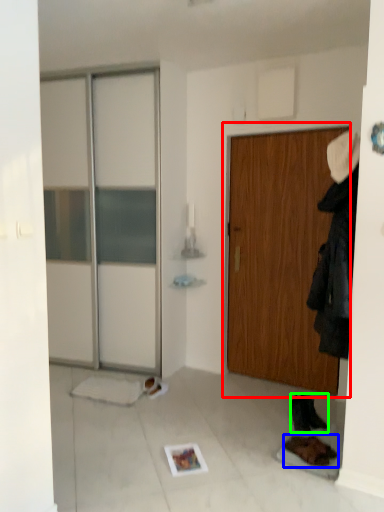
Question: Estimate the real-world distances between objects in this image. Which object is closer to door (highlighted by a red box), footwear (highlighted by a blue box) or footwear (highlighted by a green box)?

Choices:
 (A) footwear
 (B) footwear

Answer: (B)